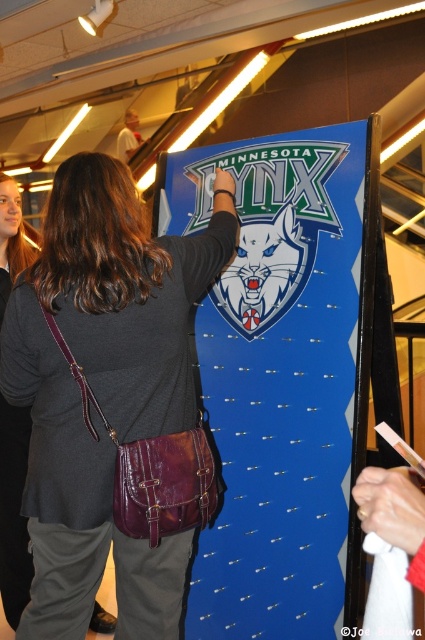
Does blue glossy poster at center have a lesser width compared to leather crossbody bag at center?

No, blue glossy poster at center is not thinner than leather crossbody bag at center.

Is blue glossy poster at center wider than leather crossbody bag at center?

Correct, the width of blue glossy poster at center exceeds that of leather crossbody bag at center.

Between point (368, 378) and point (161, 298), which one is positioned behind?

The point (368, 378) is behind.

The width and height of the screenshot is (425, 640). Find the location of `blue glossy poster at center`. blue glossy poster at center is located at coordinates (282, 376).